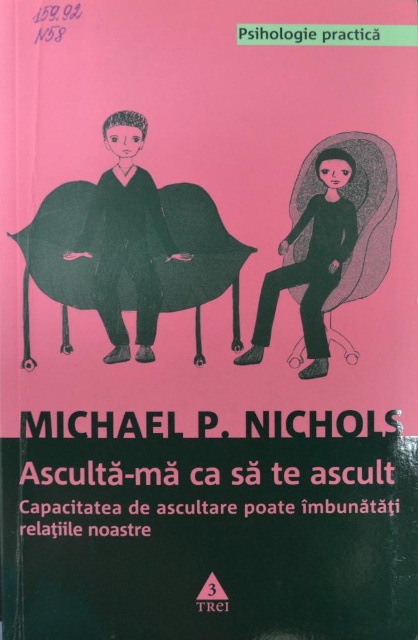
From the picture: What are the coordinates of the black matte blanket at center?

The coordinates of the black matte blanket at center are at point [196,250].

You are an interior designer working on a book cover layout. You need to ensure that the white paper at center and the black matte figure at center are arranged so that the white paper is not overlapping the figure. Based on the current design, is this requirement met?

The white paper at center is below the black matte figure at center, so it is not overlapping. The requirement is met.